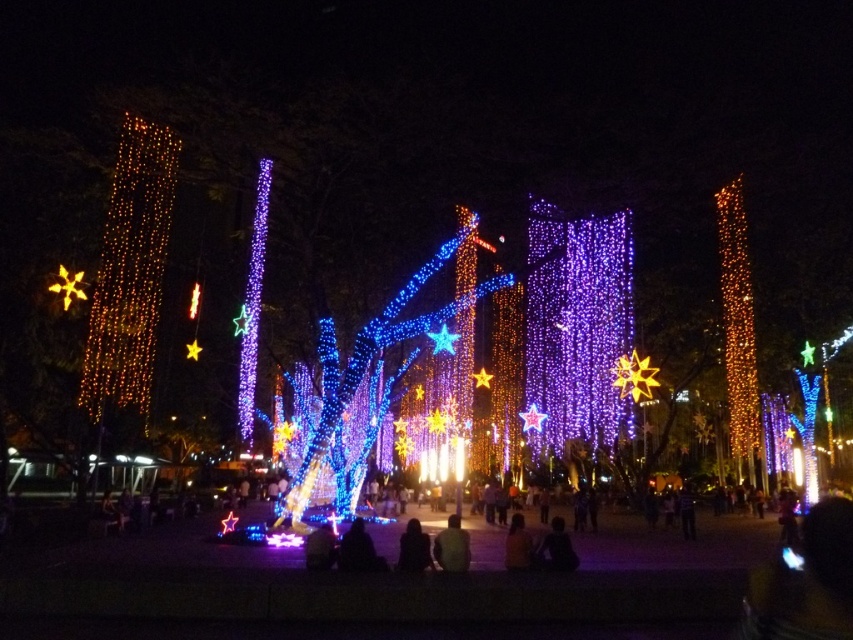
Which of these two, dark fabric person at center or dark brown leather jacket at center, stands taller?

dark fabric person at center is taller.

Does dark fabric person at center have a greater width compared to dark brown leather jacket at center?

Yes, dark fabric person at center is wider than dark brown leather jacket at center.

Who is more distant from viewer, (357,557) or (456,548)?

Point (456,548)

Where is `dark fabric person at center`? The image size is (853, 640). dark fabric person at center is located at coordinates (358, 550).

Is dark blue fabric at center shorter than black matte person at lower center?

Yes, dark blue fabric at center is shorter than black matte person at lower center.

Who is lower down, dark blue fabric at center or black matte person at lower center?

black matte person at lower center is below.

Who is more forward, (540, 548) or (317, 548)?

Point (540, 548) is in front.

Locate an element on the screen. dark blue fabric at center is located at coordinates (556, 548).

Is warm golden lights at left positioned in front of black matte person at lower center?

No.

Does warm golden lights at left have a lesser height compared to black matte person at lower center?

No.

Which is in front, point (102, 378) or point (318, 570)?

Point (318, 570) is in front.

Find the location of a particular element. This screenshot has height=640, width=853. warm golden lights at left is located at coordinates (131, 272).